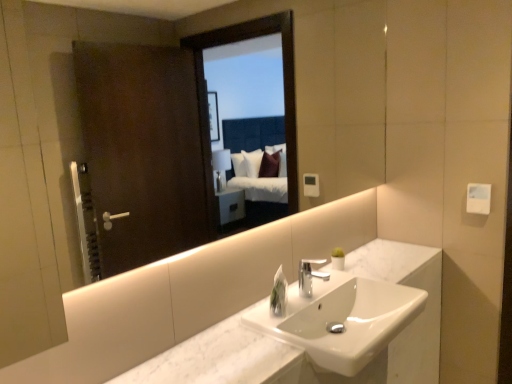
In order to click on vacant region in front of clear plastic soap dispenser at center in this screenshot , I will do `click(274, 322)`.